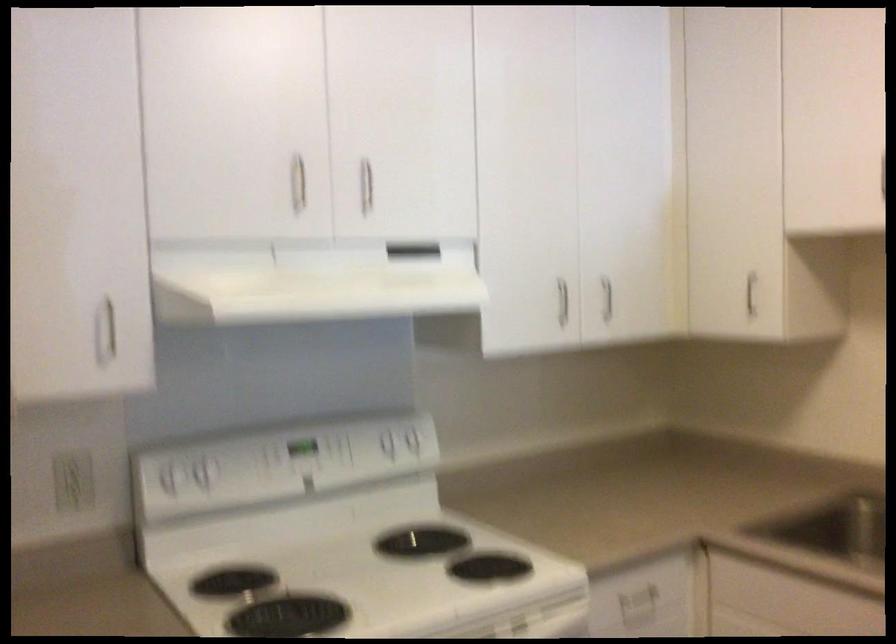
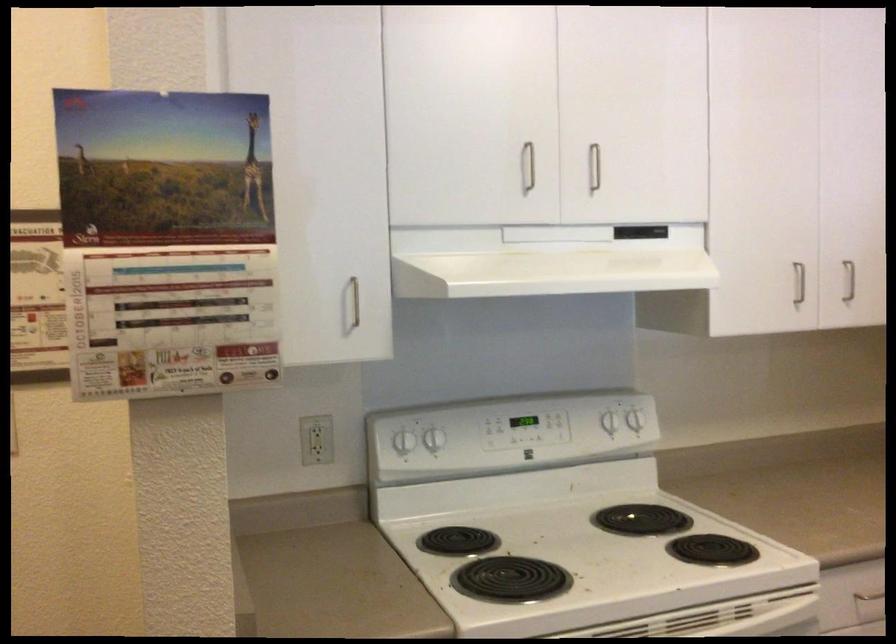
Where in the second image is the point corresponding to point 365,190 from the first image?

(593, 167)